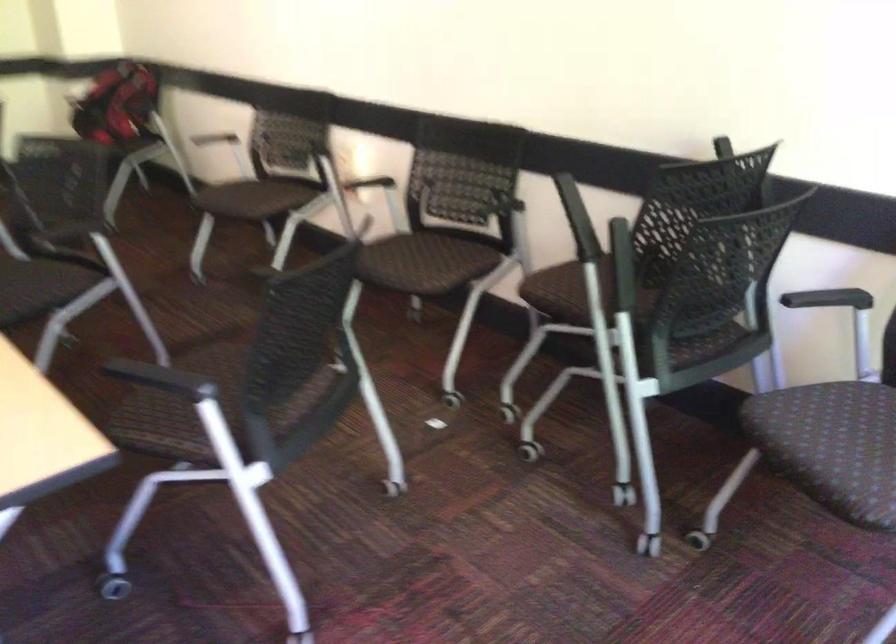
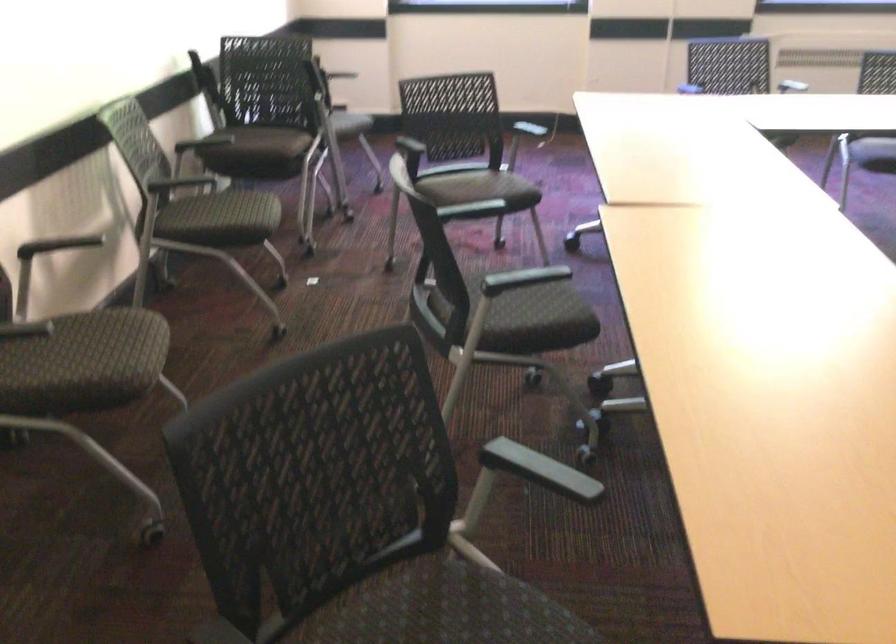
Locate, in the second image, the point that corresponds to point 220,377 in the first image.

(479, 189)